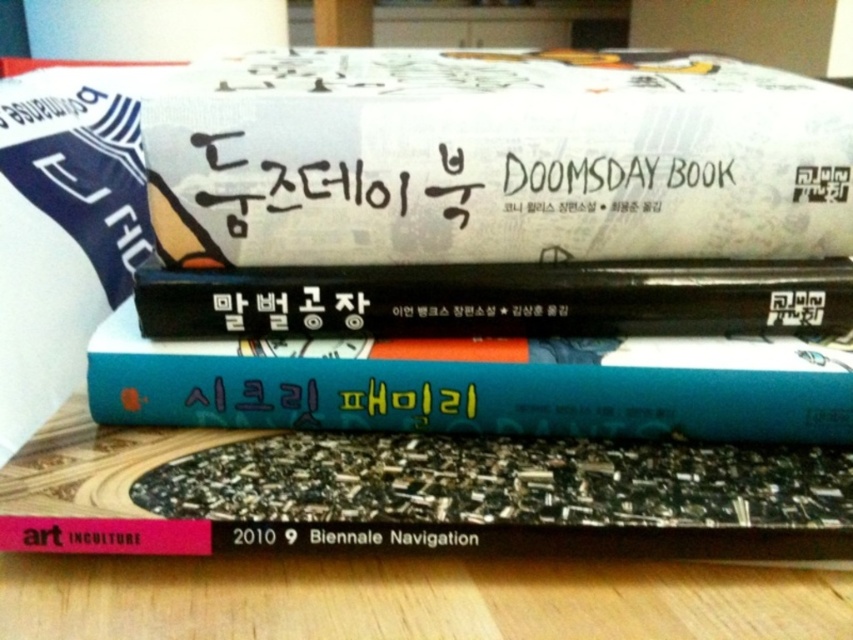
Question: Can you confirm if white paper book at center is smaller than blue matte book at center?

Choices:
 (A) no
 (B) yes

Answer: (A)

Question: Which of the following is the closest to the observer?

Choices:
 (A) (733, 177)
 (B) (137, 436)

Answer: (A)

Question: Among these objects, which one is farthest from the camera?

Choices:
 (A) black textured book at center
 (B) blue matte book at center
 (C) black matte book at center
 (D) white paper book at center

Answer: (C)

Question: Is black textured book at center bigger than black matte book at center?

Choices:
 (A) no
 (B) yes

Answer: (B)

Question: Can you confirm if white paper book at center is positioned to the left of black textured book at center?

Choices:
 (A) no
 (B) yes

Answer: (A)

Question: Which point is farther to the camera?

Choices:
 (A) (469, 474)
 (B) (376, 352)
 (C) (697, 170)

Answer: (B)